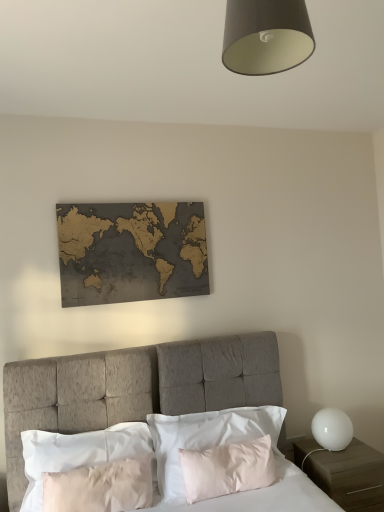
Where is `free space above gold-toned wood world map at upper center (from a real-world perspective)`? This screenshot has height=512, width=384. free space above gold-toned wood world map at upper center (from a real-world perspective) is located at coordinates (136, 201).